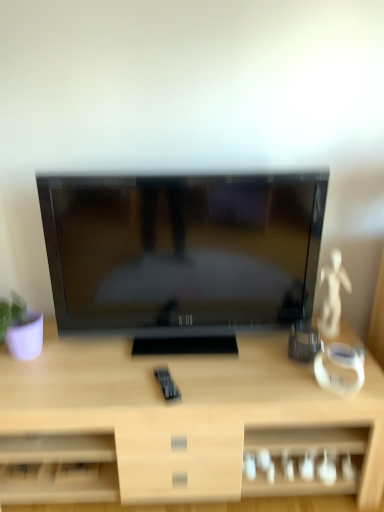
Question: From a real-world perspective, is light wood desk at center positioned above or below matte black tv at center?

Choices:
 (A) below
 (B) above

Answer: (A)

Question: Considering the positions of light wood desk at center and matte black tv at center in the image, is light wood desk at center wider or thinner than matte black tv at center?

Choices:
 (A) wide
 (B) thin

Answer: (A)

Question: From the image's perspective, is light wood desk at center above or below matte black tv at center?

Choices:
 (A) below
 (B) above

Answer: (A)

Question: Do you think matte black tv at center is within light wood desk at center, or outside of it?

Choices:
 (A) outside
 (B) inside

Answer: (A)

Question: From the image's perspective, is matte black tv at center above or below light wood desk at center?

Choices:
 (A) below
 (B) above

Answer: (B)

Question: Considering the positions of matte black tv at center and light wood desk at center in the image, is matte black tv at center taller or shorter than light wood desk at center?

Choices:
 (A) short
 (B) tall

Answer: (B)

Question: In terms of width, does matte black tv at center look wider or thinner when compared to light wood desk at center?

Choices:
 (A) wide
 (B) thin

Answer: (B)